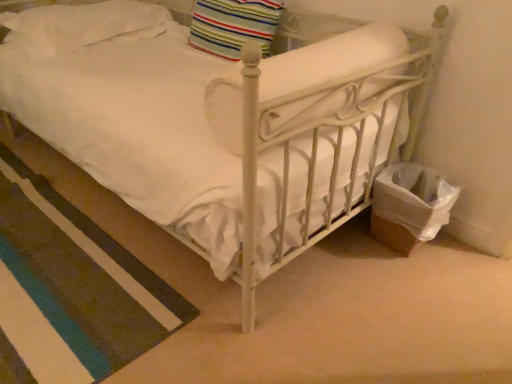
Question: From the image's perspective, relative to white soft pillow at upper left, which is counted as the second pillow, starting from the right, is white soft rug at lower left above or below?

Choices:
 (A) above
 (B) below

Answer: (B)

Question: Considering the positions of white soft rug at lower left and white soft pillow at upper left, which is counted as the second pillow, starting from the right, in the image, is white soft rug at lower left taller or shorter than white soft pillow at upper left, which is counted as the second pillow, starting from the right,?

Choices:
 (A) short
 (B) tall

Answer: (A)

Question: Which object is positioned farthest from the white soft rug at lower left?

Choices:
 (A) white soft pillow at upper left, which is counted as the second pillow, starting from the right
 (B) striped fabric pillow at upper center, placed as the first pillow when sorted from right to left

Answer: (B)

Question: Estimate the real-world distances between objects in this image. Which object is closer to the white soft rug at lower left?

Choices:
 (A) striped fabric pillow at upper center, the 2th pillow positioned from the left
 (B) white soft pillow at upper left, marked as the first pillow in a left-to-right arrangement

Answer: (B)